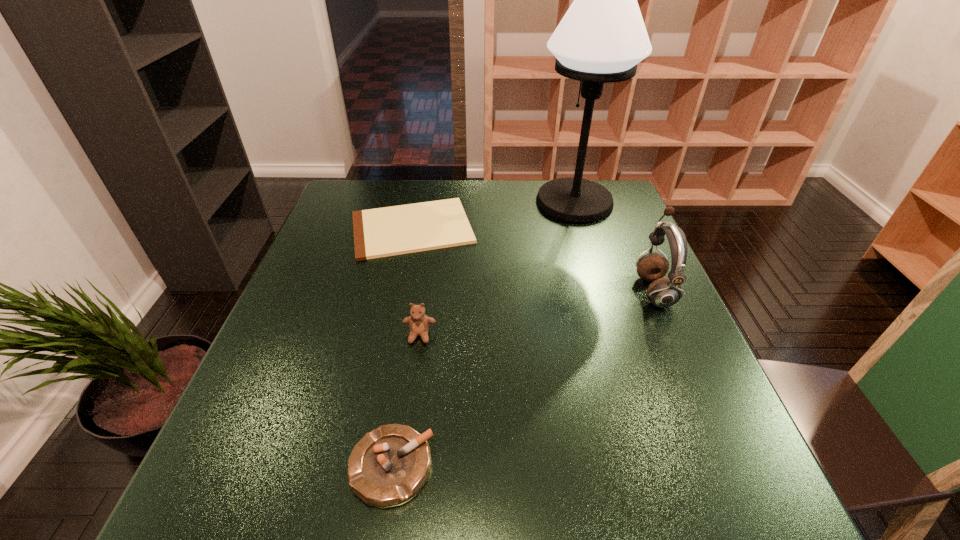
The width and height of the screenshot is (960, 540). In order to click on free spot that satisfies the following two spatial constraints: 1. on the front side of the clipboard; 2. on the right side of the nearest object in this screenshot , I will do `click(364, 467)`.